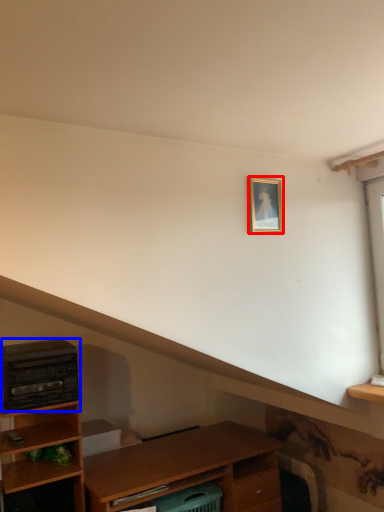
Question: Among these objects, which one is nearest to the camera, picture frame (highlighted by a red box) or appliance (highlighted by a blue box)?

Choices:
 (A) picture frame
 (B) appliance

Answer: (A)